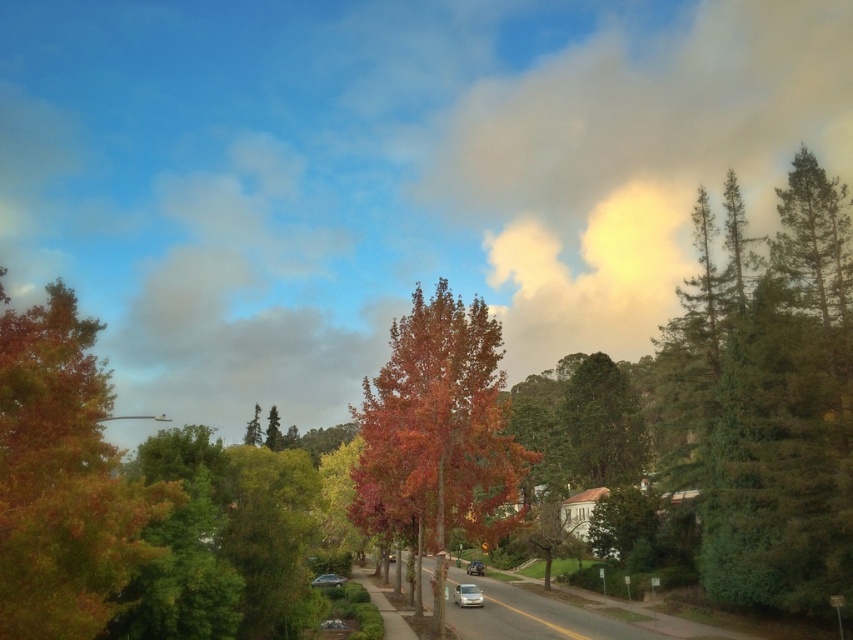
You are standing on the sidewalk and see the white matte car at center and the green textured tree at center. Which one is closer to the right side of the road?

The white matte car at center is to the right of the green textured tree at center, so it is closer to the right side of the road.

You are a pedestrian standing at the edge of the sidewalk on the left side of the street. You want to cross the street to reach the green textured tree at center. The white matte car at center is approaching. Given that the car is moving at 20 km per hour, will you have enough time to safely cross the 3 meter wide street before the car reaches you?

The distance between the white matte car at center and the green textured tree at center is 69.56 meters. Since the car is moving at 20 km per hour, it will take approximately 12.5 seconds to cover that distance. A pedestrian can safely cross a 3 meter wide street in under 2 seconds, so there is ample time to cross before the car arrives.